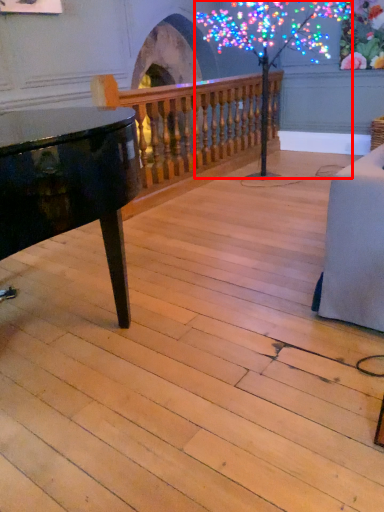
Question: From the image's perspective, what is the correct spatial positioning of tree (annotated by the red box) in reference to rail?

Choices:
 (A) below
 (B) above

Answer: (B)